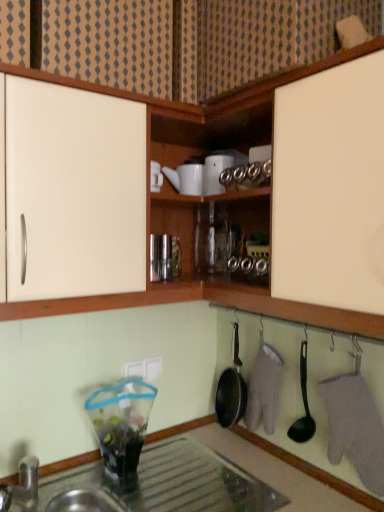
You are a GUI agent. You are given a task and a screenshot of the screen. Output one action in this format:
    pyautogui.click(x=<x>, y=<y>)
    Task: Click on the transparent glass countertop at lower left
    The image size is (384, 512).
    Given the screenshot: What is the action you would take?
    pyautogui.click(x=311, y=470)

This screenshot has height=512, width=384. Describe the element at coordinates (186, 178) in the screenshot. I see `white matte teapot at upper center, which ranks as the second appliance in top-to-bottom order` at that location.

At what (x,y) coordinates should I click in order to perform the action: click on clear plastic bag at lower left, the first appliance ordered from the bottom. Please return your answer as a coordinate pair (x, y). This screenshot has width=384, height=512. Looking at the image, I should click on (121, 423).

Locate an element on the screen. Image resolution: width=384 pixels, height=512 pixels. black plastic spoon at lower center is located at coordinates (304, 405).

Locate an element on the screen. This screenshot has height=512, width=384. white plastic electric outlet at lower center is located at coordinates (145, 369).

At what (x,y) coordinates should I click in order to perform the action: click on white matte cabinet at upper center. Please return your answer as a coordinate pair (x, y). Looking at the image, I should click on (191, 41).

Could you tell me if metallic glass jar at center, which appears as the second appliance when ordered from the bottom, is turned towards white glossy teapot at upper center, which ranks as the first appliance in top-to-bottom order?

No, metallic glass jar at center, which appears as the second appliance when ordered from the bottom, is not facing towards white glossy teapot at upper center, which ranks as the first appliance in top-to-bottom order.

From the picture: From a real-world perspective, is metallic glass jar at center, which appears as the second appliance when ordered from the bottom, positioned over white glossy teapot at upper center, which ranks as the first appliance in top-to-bottom order, based on gravity?

Incorrect, from a real-world perspective, metallic glass jar at center, which appears as the second appliance when ordered from the bottom, is lower than white glossy teapot at upper center, which ranks as the first appliance in top-to-bottom order.

Based on the photo, would you say metallic glass jar at center, which appears as the second appliance when ordered from the bottom, is to the left or to the right of white glossy teapot at upper center, the 4th appliance ordered from the bottom, in the picture?

In the image, metallic glass jar at center, which appears as the second appliance when ordered from the bottom, appears on the left side of white glossy teapot at upper center, the 4th appliance ordered from the bottom.

Which is more to the left, white glossy teapot at upper center, which ranks as the first appliance in top-to-bottom order, or black plastic spoon at lower center?

Positioned to the left is white glossy teapot at upper center, which ranks as the first appliance in top-to-bottom order.

From a real-world perspective, is white glossy teapot at upper center, the 4th appliance ordered from the bottom, physically located above or below black plastic spoon at lower center?

Clearly, from a real-world perspective, white glossy teapot at upper center, the 4th appliance ordered from the bottom, is above black plastic spoon at lower center.

Would you say white glossy teapot at upper center, the 4th appliance ordered from the bottom, contains black plastic spoon at lower center?

No, white glossy teapot at upper center, the 4th appliance ordered from the bottom, does not contain black plastic spoon at lower center.

Is white glossy teapot at upper center, the 4th appliance ordered from the bottom, looking in the opposite direction of black plastic spoon at lower center?

No, white glossy teapot at upper center, the 4th appliance ordered from the bottom, is not facing away from black plastic spoon at lower center.

Consider the image. From a real-world perspective, is white matte teapot at upper center, which ranks as the second appliance in top-to-bottom order, positioned above or below white matte cabinet at upper center?

Clearly, from a real-world perspective, white matte teapot at upper center, which ranks as the second appliance in top-to-bottom order, is below white matte cabinet at upper center.

Between white matte teapot at upper center, which ranks as the second appliance in top-to-bottom order, and white matte cabinet at upper center, which one has smaller size?

white matte teapot at upper center, which ranks as the second appliance in top-to-bottom order.

Is there a large distance between white matte teapot at upper center, which ranks as the second appliance in top-to-bottom order, and white matte cabinet at upper center?

white matte teapot at upper center, which ranks as the second appliance in top-to-bottom order, is actually quite close to white matte cabinet at upper center.

Which object is closer to the camera, white matte teapot at upper center, which ranks as the second appliance in top-to-bottom order, or white matte cabinet at upper center?

white matte cabinet at upper center is more forward.

Which object is positioned more to the right, white matte teapot at upper center, which is counted as the 3th appliance, starting from the bottom, or white plastic electric outlet at lower center?

white matte teapot at upper center, which is counted as the 3th appliance, starting from the bottom.

In the scene shown: Does white matte teapot at upper center, which ranks as the second appliance in top-to-bottom order, have a lesser height compared to white plastic electric outlet at lower center?

In fact, white matte teapot at upper center, which ranks as the second appliance in top-to-bottom order, may be taller than white plastic electric outlet at lower center.

Which is in front, white matte teapot at upper center, which is counted as the 3th appliance, starting from the bottom, or white plastic electric outlet at lower center?

white matte teapot at upper center, which is counted as the 3th appliance, starting from the bottom, is in front.

Does white matte teapot at upper center, which ranks as the second appliance in top-to-bottom order, contain white plastic electric outlet at lower center?

No, white plastic electric outlet at lower center is located outside of white matte teapot at upper center, which ranks as the second appliance in top-to-bottom order.

Is the depth of metallic glass jar at center, which is the third appliance in top-to-bottom order, less than that of transparent glass countertop at lower left?

No, metallic glass jar at center, which is the third appliance in top-to-bottom order, is further to the viewer.

Is transparent glass countertop at lower left a part of metallic glass jar at center, which is the third appliance in top-to-bottom order?

No, transparent glass countertop at lower left is not inside metallic glass jar at center, which is the third appliance in top-to-bottom order.

From a real-world perspective, does metallic glass jar at center, which appears as the second appliance when ordered from the bottom, stand above transparent glass countertop at lower left?

Correct, in the physical world, metallic glass jar at center, which appears as the second appliance when ordered from the bottom, is higher than transparent glass countertop at lower left.

Does metallic glass jar at center, which appears as the second appliance when ordered from the bottom, have a lesser height compared to transparent glass countertop at lower left?

Yes, metallic glass jar at center, which appears as the second appliance when ordered from the bottom, is shorter than transparent glass countertop at lower left.

Which object is thinner, transparent glass countertop at lower left or white matte teapot at upper center, which ranks as the second appliance in top-to-bottom order?

white matte teapot at upper center, which ranks as the second appliance in top-to-bottom order.

From a real-world perspective, which object stands above the other?

white matte teapot at upper center, which ranks as the second appliance in top-to-bottom order, from a real-world perspective.

From the picture: Considering the positions of objects transparent glass countertop at lower left and white matte teapot at upper center, which ranks as the second appliance in top-to-bottom order, in the image provided, who is more to the right, transparent glass countertop at lower left or white matte teapot at upper center, which ranks as the second appliance in top-to-bottom order,?

white matte teapot at upper center, which ranks as the second appliance in top-to-bottom order, is more to the right.

From the image's perspective, is transparent glass countertop at lower left above white matte teapot at upper center, which ranks as the second appliance in top-to-bottom order?

No.

How many degrees apart are the facing directions of white plastic electric outlet at lower center and white matte teapot at upper center, which ranks as the second appliance in top-to-bottom order?

The angle between the facing direction of white plastic electric outlet at lower center and the facing direction of white matte teapot at upper center, which ranks as the second appliance in top-to-bottom order, is 1.83 degrees.

Considering the sizes of objects white plastic electric outlet at lower center and white matte teapot at upper center, which is counted as the 3th appliance, starting from the bottom, in the image provided, who is shorter, white plastic electric outlet at lower center or white matte teapot at upper center, which is counted as the 3th appliance, starting from the bottom,?

white plastic electric outlet at lower center.

Is the surface of white plastic electric outlet at lower center in direct contact with white matte teapot at upper center, which is counted as the 3th appliance, starting from the bottom?

No, white plastic electric outlet at lower center is not with white matte teapot at upper center, which is counted as the 3th appliance, starting from the bottom.

Is white plastic electric outlet at lower center oriented away from white matte teapot at upper center, which is counted as the 3th appliance, starting from the bottom?

That's not correct — white plastic electric outlet at lower center is not looking away from white matte teapot at upper center, which is counted as the 3th appliance, starting from the bottom.

From the metallic glass jar at center, which appears as the second appliance when ordered from the bottom, count 1st appliances forward and point to it. Please provide its 2D coordinates.

[(215, 173)]

From the black plastic spoon at lower center, count 1st appliances backward and point to it. Please provide its 2D coordinates.

[(215, 173)]

From the picture: Estimate the real-world distances between objects in this image. Which object is further from white glossy teapot at upper center, the 4th appliance ordered from the bottom, clear plastic bag at lower left, the first appliance ordered from the bottom, or white matte cabinet at upper center?

Based on the image, clear plastic bag at lower left, the first appliance ordered from the bottom, appears to be further to white glossy teapot at upper center, the 4th appliance ordered from the bottom.

Based on their spatial positions, is white matte teapot at upper center, which is counted as the 3th appliance, starting from the bottom, or white glossy teapot at upper center, which ranks as the first appliance in top-to-bottom order, closer to transparent glass countertop at lower left?

Among the two, white glossy teapot at upper center, which ranks as the first appliance in top-to-bottom order, is located nearer to transparent glass countertop at lower left.

From the image, which object appears to be nearer to clear plastic bag at lower left, marked as the 4th appliance in a top-to-bottom arrangement, transparent glass countertop at lower left or metallic glass jar at center, which appears as the second appliance when ordered from the bottom?

transparent glass countertop at lower left.

Looking at this image, when comparing their distances from clear plastic bag at lower left, the first appliance ordered from the bottom, does white plastic electric outlet at lower center or transparent glass countertop at lower left seem closer?

Among the two, white plastic electric outlet at lower center is located nearer to clear plastic bag at lower left, the first appliance ordered from the bottom.

Based on their spatial positions, is transparent glass countertop at lower left or clear plastic bag at lower left, the first appliance ordered from the bottom, further from white matte cabinet at upper center?

Based on the image, transparent glass countertop at lower left appears to be further to white matte cabinet at upper center.

When comparing their distances from white matte teapot at upper center, which is counted as the 3th appliance, starting from the bottom, does white glossy teapot at upper center, the 4th appliance ordered from the bottom, or metallic glass jar at center, which is the third appliance in top-to-bottom order, seem further?

metallic glass jar at center, which is the third appliance in top-to-bottom order.

Considering their positions, is transparent glass countertop at lower left positioned further to white matte teapot at upper center, which is counted as the 3th appliance, starting from the bottom, than white glossy teapot at upper center, the 4th appliance ordered from the bottom?

transparent glass countertop at lower left.

Looking at the image, which one is located closer to clear plastic bag at lower left, marked as the 4th appliance in a top-to-bottom arrangement, white plastic electric outlet at lower center or white glossy teapot at upper center, which ranks as the first appliance in top-to-bottom order?

white plastic electric outlet at lower center lies closer to clear plastic bag at lower left, marked as the 4th appliance in a top-to-bottom arrangement, than the other object.

The height and width of the screenshot is (512, 384). I want to click on electric outlet between white matte teapot at upper center, which is counted as the 3th appliance, starting from the bottom, and clear plastic bag at lower left, marked as the 4th appliance in a top-to-bottom arrangement, in the vertical direction, so click(x=145, y=369).

At what (x,y) coordinates should I click in order to perform the action: click on spoon between white matte teapot at upper center, which is counted as the 3th appliance, starting from the bottom, and transparent glass countertop at lower left from top to bottom. Please return your answer as a coordinate pair (x, y). Looking at the image, I should click on (304, 405).

At what (x,y) coordinates should I click in order to perform the action: click on electric outlet that lies between white glossy teapot at upper center, the 4th appliance ordered from the bottom, and transparent glass countertop at lower left from top to bottom. Please return your answer as a coordinate pair (x, y). Looking at the image, I should click on (145, 369).

The width and height of the screenshot is (384, 512). I want to click on spoon between transparent glass countertop at lower left and white plastic electric outlet at lower center from front to back, so click(x=304, y=405).